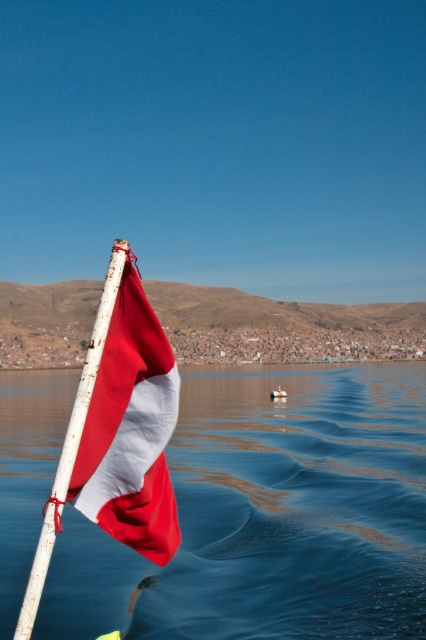
Question: Among these objects, which one is farthest from the camera?

Choices:
 (A) white matte pole at left
 (B) matte fabric flag at left
 (C) blue water at lower left

Answer: (B)

Question: Which point is farther to the camera?

Choices:
 (A) (65, 468)
 (B) (69, 548)
 (C) (100, 412)

Answer: (B)

Question: Does blue water at lower left appear on the right side of matte fabric flag at left?

Choices:
 (A) no
 (B) yes

Answer: (A)

Question: Which object appears farthest from the camera in this image?

Choices:
 (A) blue water at lower left
 (B) matte fabric flag at left

Answer: (B)

Question: Can you confirm if blue water at lower left is positioned above matte fabric flag at left?

Choices:
 (A) no
 (B) yes

Answer: (A)

Question: Can you confirm if matte fabric flag at left is positioned to the right of white matte pole at left?

Choices:
 (A) yes
 (B) no

Answer: (A)